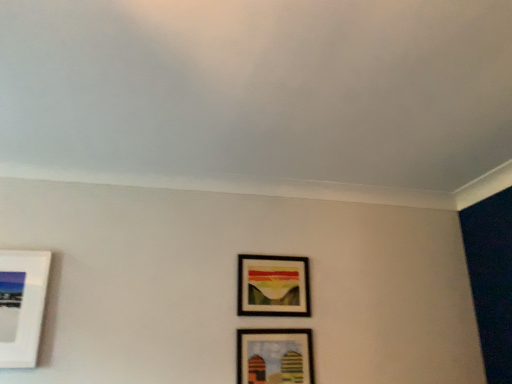
What is the approximate width of wooden framed artwork at center, the 2th picture frame in the bottom-to-top sequence?

1.47 inches.

Describe the element at coordinates (273, 286) in the screenshot. I see `wooden framed artwork at center, positioned as the first picture frame in top-to-bottom order` at that location.

Measure the distance between wooden framed artwork at center, positioned as the first picture frame in top-to-bottom order, and camera.

2.09 meters.

Locate an element on the screen. Image resolution: width=512 pixels, height=384 pixels. wooden framed artwork at center, the 2th picture frame in the bottom-to-top sequence is located at coordinates pos(273,286).

Where is `wooden framed picture at lower center, positioned as the 1th picture frame in bottom-to-top order`? wooden framed picture at lower center, positioned as the 1th picture frame in bottom-to-top order is located at coordinates (274, 356).

What is the approximate width of wooden framed picture at lower center, positioned as the 1th picture frame in bottom-to-top order?

wooden framed picture at lower center, positioned as the 1th picture frame in bottom-to-top order, is 1.29 inches in width.

What do you see at coordinates (274, 356) in the screenshot?
I see `wooden framed picture at lower center, which appears as the second picture frame when viewed from the top` at bounding box center [274, 356].

In order to click on wooden framed artwork at center, the 2th picture frame in the bottom-to-top sequence in this screenshot , I will do `click(273, 286)`.

Is wooden framed picture at lower center, positioned as the 1th picture frame in bottom-to-top order, to the right of wooden framed artwork at center, the 2th picture frame in the bottom-to-top sequence, from the viewer's perspective?

Indeed, wooden framed picture at lower center, positioned as the 1th picture frame in bottom-to-top order, is positioned on the right side of wooden framed artwork at center, the 2th picture frame in the bottom-to-top sequence.

Is wooden framed picture at lower center, positioned as the 1th picture frame in bottom-to-top order, closer to camera compared to wooden framed artwork at center, positioned as the first picture frame in top-to-bottom order?

Yes.

Considering the points (261, 338) and (256, 291), which point is in front, point (261, 338) or point (256, 291)?

Point (261, 338)

From the image's perspective, between wooden framed picture at lower center, which appears as the second picture frame when viewed from the top, and wooden framed artwork at center, the 2th picture frame in the bottom-to-top sequence, who is located below?

wooden framed picture at lower center, which appears as the second picture frame when viewed from the top, is shown below in the image.

From a real-world perspective, between wooden framed picture at lower center, positioned as the 1th picture frame in bottom-to-top order, and wooden framed artwork at center, the 2th picture frame in the bottom-to-top sequence, who is vertically higher?

wooden framed artwork at center, the 2th picture frame in the bottom-to-top sequence.

Which of these two, wooden framed picture at lower center, positioned as the 1th picture frame in bottom-to-top order, or wooden framed artwork at center, the 2th picture frame in the bottom-to-top sequence, is wider?

With larger width is wooden framed artwork at center, the 2th picture frame in the bottom-to-top sequence.

Can you confirm if wooden framed picture at lower center, which appears as the second picture frame when viewed from the top, is taller than wooden framed artwork at center, the 2th picture frame in the bottom-to-top sequence?

Incorrect, the height of wooden framed picture at lower center, which appears as the second picture frame when viewed from the top, is not larger of that of wooden framed artwork at center, the 2th picture frame in the bottom-to-top sequence.

Which of these two, wooden framed picture at lower center, positioned as the 1th picture frame in bottom-to-top order, or wooden framed artwork at center, the 2th picture frame in the bottom-to-top sequence, is bigger?

With larger size is wooden framed artwork at center, the 2th picture frame in the bottom-to-top sequence.

Can we say wooden framed picture at lower center, positioned as the 1th picture frame in bottom-to-top order, lies outside wooden framed artwork at center, positioned as the first picture frame in top-to-bottom order?

Indeed, wooden framed picture at lower center, positioned as the 1th picture frame in bottom-to-top order, is completely outside wooden framed artwork at center, positioned as the first picture frame in top-to-bottom order.

Is wooden framed picture at lower center, positioned as the 1th picture frame in bottom-to-top order, not near wooden framed artwork at center, the 2th picture frame in the bottom-to-top sequence?

wooden framed picture at lower center, positioned as the 1th picture frame in bottom-to-top order, is near wooden framed artwork at center, the 2th picture frame in the bottom-to-top sequence, not far away.

Does wooden framed picture at lower center, which appears as the second picture frame when viewed from the top, turn towards wooden framed artwork at center, the 2th picture frame in the bottom-to-top sequence?

No, wooden framed picture at lower center, which appears as the second picture frame when viewed from the top, is not aimed at wooden framed artwork at center, the 2th picture frame in the bottom-to-top sequence.

Identify the location of picture frame located in front of the wooden framed artwork at center, positioned as the first picture frame in top-to-bottom order. (274, 356).

Which is more to the left, wooden framed artwork at center, positioned as the first picture frame in top-to-bottom order, or wooden framed picture at lower center, positioned as the 1th picture frame in bottom-to-top order?

wooden framed artwork at center, positioned as the first picture frame in top-to-bottom order, is more to the left.

Relative to wooden framed picture at lower center, which appears as the second picture frame when viewed from the top, is wooden framed artwork at center, positioned as the first picture frame in top-to-bottom order, in front or behind?

wooden framed artwork at center, positioned as the first picture frame in top-to-bottom order, is behind wooden framed picture at lower center, which appears as the second picture frame when viewed from the top.

Which is closer to the camera, (276,282) or (254,340)?

The point (254,340) is closer.

From the image's perspective, is wooden framed artwork at center, positioned as the first picture frame in top-to-bottom order, positioned above or below wooden framed picture at lower center, which appears as the second picture frame when viewed from the top?

Based on their image positions, wooden framed artwork at center, positioned as the first picture frame in top-to-bottom order, is located above wooden framed picture at lower center, which appears as the second picture frame when viewed from the top.

From a real-world perspective, which is physically above, wooden framed artwork at center, positioned as the first picture frame in top-to-bottom order, or wooden framed picture at lower center, which appears as the second picture frame when viewed from the top?

From a 3D spatial view, wooden framed artwork at center, positioned as the first picture frame in top-to-bottom order, is above.

Which of these two, wooden framed artwork at center, the 2th picture frame in the bottom-to-top sequence, or wooden framed picture at lower center, positioned as the 1th picture frame in bottom-to-top order, is thinner?

Thinner between the two is wooden framed picture at lower center, positioned as the 1th picture frame in bottom-to-top order.

Considering the relative sizes of wooden framed artwork at center, positioned as the first picture frame in top-to-bottom order, and wooden framed picture at lower center, which appears as the second picture frame when viewed from the top, in the image provided, is wooden framed artwork at center, positioned as the first picture frame in top-to-bottom order, shorter than wooden framed picture at lower center, which appears as the second picture frame when viewed from the top,?

No, wooden framed artwork at center, positioned as the first picture frame in top-to-bottom order, is not shorter than wooden framed picture at lower center, which appears as the second picture frame when viewed from the top.

Does wooden framed artwork at center, positioned as the first picture frame in top-to-bottom order, have a smaller size compared to wooden framed picture at lower center, which appears as the second picture frame when viewed from the top?

Actually, wooden framed artwork at center, positioned as the first picture frame in top-to-bottom order, might be larger than wooden framed picture at lower center, which appears as the second picture frame when viewed from the top.

Can we say wooden framed artwork at center, the 2th picture frame in the bottom-to-top sequence, lies outside wooden framed picture at lower center, positioned as the 1th picture frame in bottom-to-top order?

Yes, wooden framed artwork at center, the 2th picture frame in the bottom-to-top sequence, is not within wooden framed picture at lower center, positioned as the 1th picture frame in bottom-to-top order.

Is wooden framed artwork at center, positioned as the first picture frame in top-to-bottom order, not close to wooden framed picture at lower center, which appears as the second picture frame when viewed from the top?

No.

Is wooden framed artwork at center, the 2th picture frame in the bottom-to-top sequence, oriented towards wooden framed picture at lower center, which appears as the second picture frame when viewed from the top?

No, wooden framed artwork at center, the 2th picture frame in the bottom-to-top sequence, is not aimed at wooden framed picture at lower center, which appears as the second picture frame when viewed from the top.

How many degrees apart are the facing directions of wooden framed artwork at center, the 2th picture frame in the bottom-to-top sequence, and wooden framed picture at lower center, which appears as the second picture frame when viewed from the top?

There is a 0.0776-degree angle between the facing directions of wooden framed artwork at center, the 2th picture frame in the bottom-to-top sequence, and wooden framed picture at lower center, which appears as the second picture frame when viewed from the top.

Locate an element on the screen. picture frame that is below the wooden framed artwork at center, the 2th picture frame in the bottom-to-top sequence (from the image's perspective) is located at coordinates (274, 356).

You are a GUI agent. You are given a task and a screenshot of the screen. Output one action in this format:
    pyautogui.click(x=<x>, y=<y>)
    Task: Click on the picture frame that appears below the wooden framed artwork at center, positioned as the first picture frame in top-to-bottom order (from a real-world perspective)
    This screenshot has width=512, height=384.
    Given the screenshot: What is the action you would take?
    pyautogui.click(x=274, y=356)

You are a GUI agent. You are given a task and a screenshot of the screen. Output one action in this format:
    pyautogui.click(x=<x>, y=<y>)
    Task: Click on the picture frame lying in front of the wooden framed artwork at center, positioned as the first picture frame in top-to-bottom order
    This screenshot has height=384, width=512.
    Given the screenshot: What is the action you would take?
    pyautogui.click(x=274, y=356)